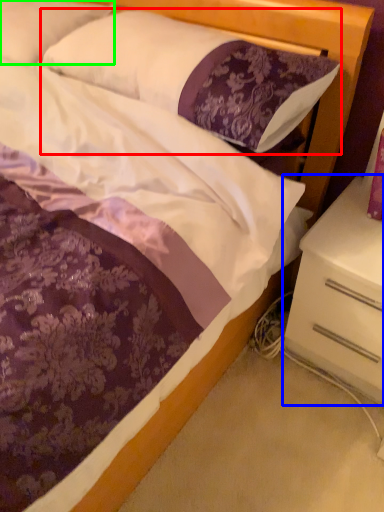
Question: Which object is positioned closest to pillow (highlighted by a red box)? Select from nightstand (highlighted by a blue box) and pillow (highlighted by a green box).

Choices:
 (A) nightstand
 (B) pillow

Answer: (B)